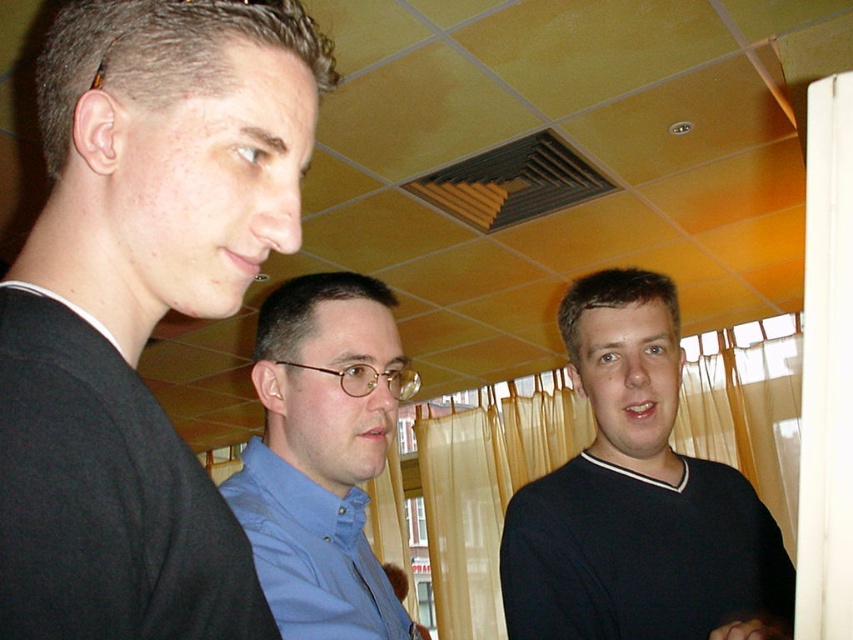
Between black matte shirt at left and blue shirt at center, which one has less height?

Standing shorter between the two is blue shirt at center.

Who is higher up, black matte shirt at left or blue shirt at center?

Positioned higher is black matte shirt at left.

Locate an element on the screen. The image size is (853, 640). black matte shirt at left is located at coordinates (141, 307).

Is black matte shirt at left smaller than dark blue sweater at center?

Yes.

Does black matte shirt at left have a greater height compared to dark blue sweater at center?

No, black matte shirt at left is not taller than dark blue sweater at center.

Measure the distance between black matte shirt at left and camera.

black matte shirt at left is 30.30 centimeters from camera.

Where is `black matte shirt at left`? Image resolution: width=853 pixels, height=640 pixels. black matte shirt at left is located at coordinates (141, 307).

Between dark blue sweater at center and blue shirt at center, which one has more height?

dark blue sweater at center is taller.

Can you confirm if dark blue sweater at center is bigger than blue shirt at center?

Indeed, dark blue sweater at center has a larger size compared to blue shirt at center.

Does point (596, 476) come behind point (322, 352)?

Yes, it is.

This screenshot has height=640, width=853. Find the location of `dark blue sweater at center`. dark blue sweater at center is located at coordinates (637, 499).